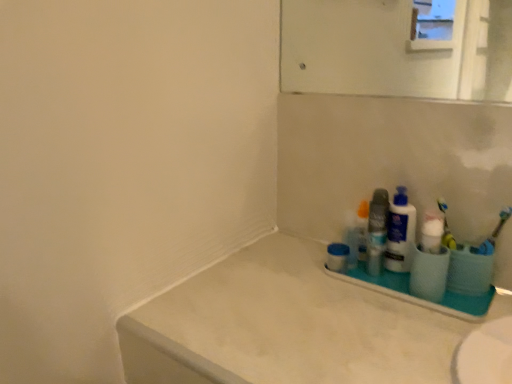
I want to click on vacant area that is in front of white plastic tray at lower right, so click(x=412, y=336).